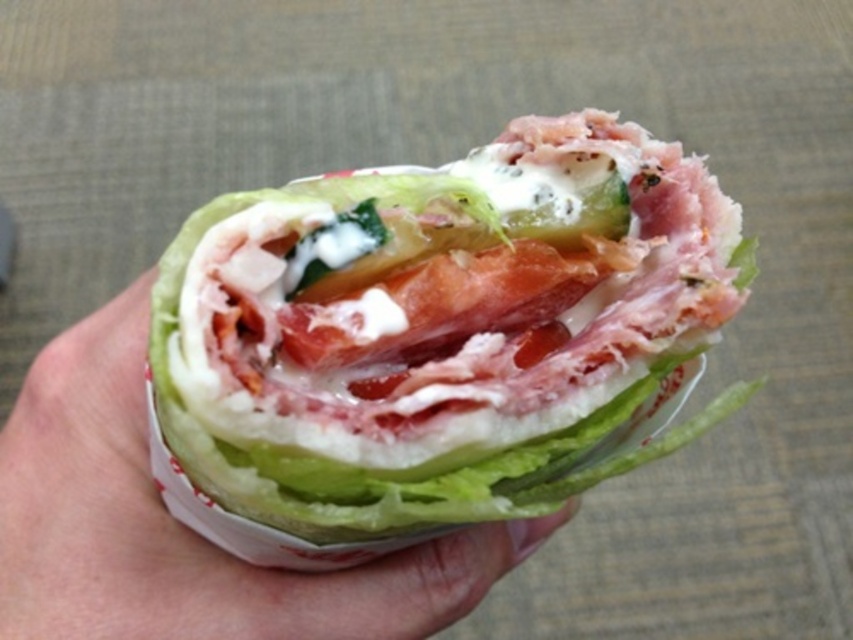
Question: Does shiny white wrap at center appear under white paper at center?

Choices:
 (A) yes
 (B) no

Answer: (B)

Question: Which point is closer to the camera taking this photo?

Choices:
 (A) (505, 378)
 (B) (48, 593)

Answer: (A)

Question: Which point is closer to the camera taking this photo?

Choices:
 (A) (468, 193)
 (B) (349, 579)

Answer: (A)

Question: Is shiny white wrap at center below white paper at center?

Choices:
 (A) yes
 (B) no

Answer: (B)

Question: Is shiny white wrap at center wider than white paper at center?

Choices:
 (A) no
 (B) yes

Answer: (A)